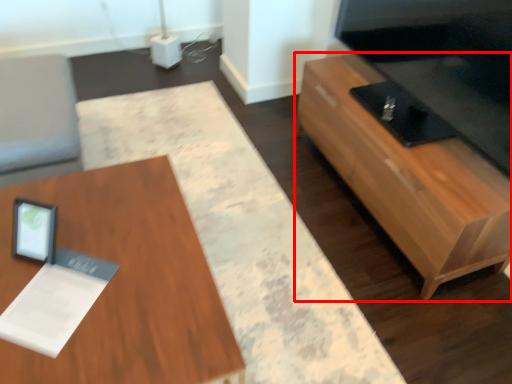
Question: From the image's perspective, where is table (annotated by the red box) located relative to table?

Choices:
 (A) below
 (B) above

Answer: (B)